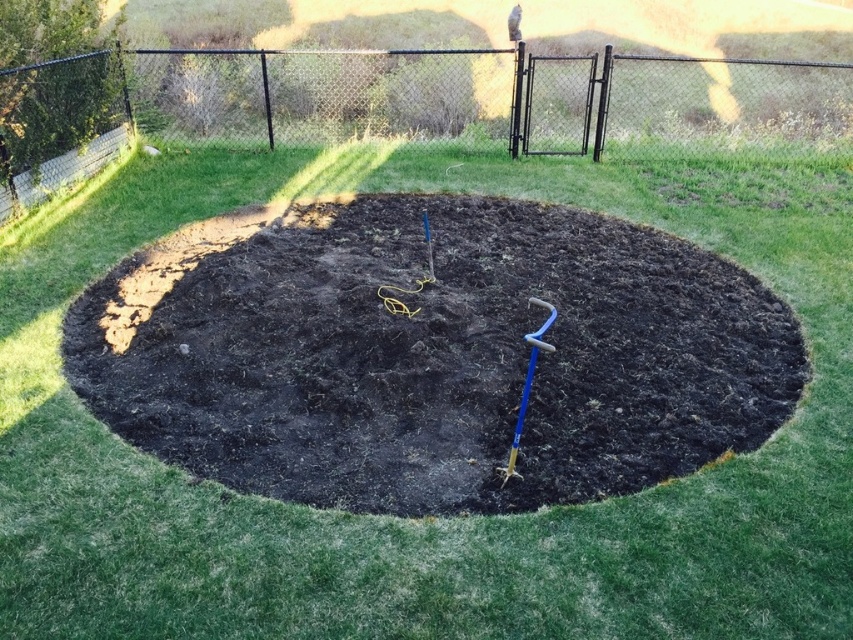
Question: Among these objects, which one is nearest to the camera?

Choices:
 (A) blue plastic shovel at center
 (B) dark soil at center

Answer: (B)

Question: Is black chain-link fence at upper center below blue plastic shovel at center?

Choices:
 (A) no
 (B) yes

Answer: (A)

Question: Can you confirm if dark soil at center is bigger than blue plastic shovel at center?

Choices:
 (A) no
 (B) yes

Answer: (B)

Question: Which point appears closest to the camera in this image?

Choices:
 (A) (32, 77)
 (B) (410, 257)

Answer: (B)

Question: Which point is closer to the camera?

Choices:
 (A) (341, 120)
 (B) (639, 324)
 (C) (534, 365)

Answer: (C)

Question: Can you confirm if black chain-link fence at upper center is positioned to the right of blue plastic shovel at center?

Choices:
 (A) no
 (B) yes

Answer: (B)